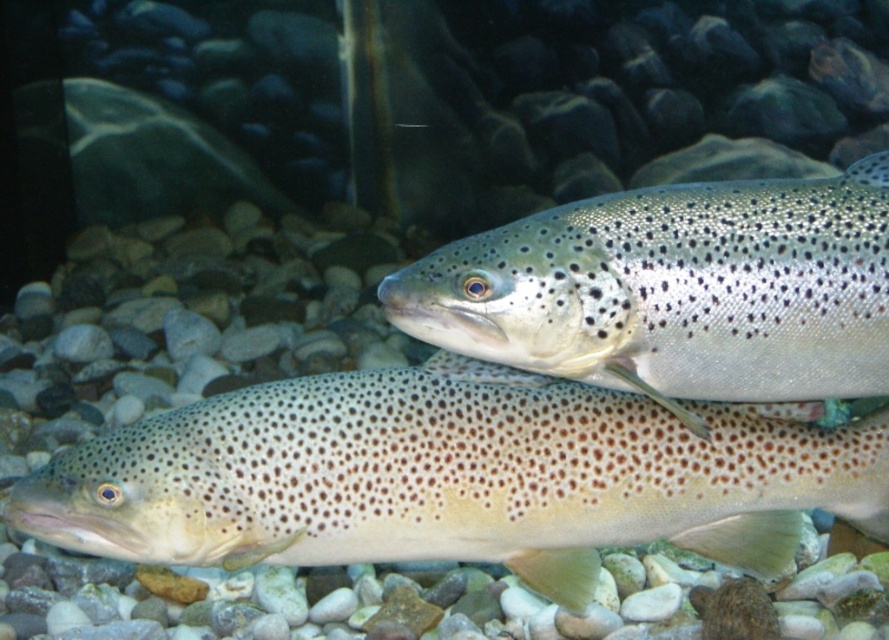
Question: Among these points, which one is nearest to the camera?

Choices:
 (A) (590, 221)
 (B) (611, 531)

Answer: (A)

Question: Which of the following is the closest to the observer?

Choices:
 (A) (573, 364)
 (B) (279, 488)

Answer: (A)

Question: Does speckled skin fish at center have a smaller size compared to speckled silver fish at center?

Choices:
 (A) yes
 (B) no

Answer: (B)

Question: From the image, what is the correct spatial relationship of speckled skin fish at center in relation to speckled silver fish at center?

Choices:
 (A) above
 (B) below

Answer: (B)

Question: Can you confirm if speckled skin fish at center is wider than speckled silver fish at center?

Choices:
 (A) no
 (B) yes

Answer: (B)